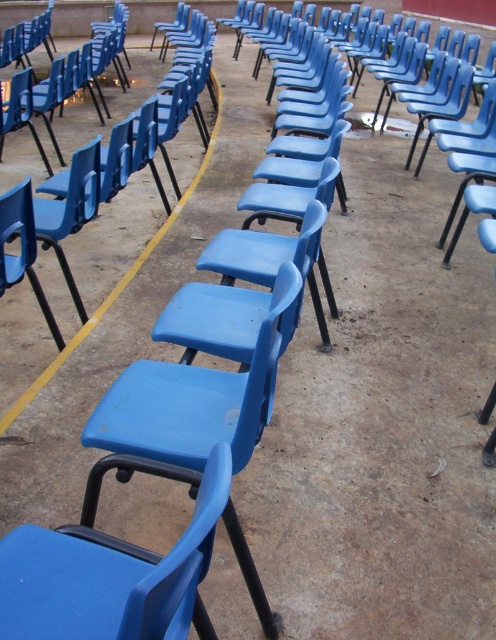
You are setting up a small event and need to place a 40 inch wide table between the blue plastic chair at center and the matte plastic chair at lower left. Based on the scene description, will the table fit without overlapping either chair?

The distance between the blue plastic chair at center and the matte plastic chair at lower left is 35.50 inches. Since the table is 40 inches wide, it will not fit as the space is narrower than the table.

You are setting up a stage for a small event and need to place a 1.5 meter tall speaker system. You have two chairs available, the blue plastic chair at center and the matte plastic chair at lower left. Which chair should you avoid placing directly in front of the speaker to ensure it doesn

The blue plastic chair at center is taller than the matte plastic chair at lower left. To avoid blocking the view, you should avoid placing the taller blue plastic chair at center directly in front of the speaker system.

You are standing at the origin point of the coordinate system, which is at the bottom left corner of the image. You see a matte plastic chair at center. What are its coordinates?

The coordinates of the matte plastic chair at center are at point (110, 576).